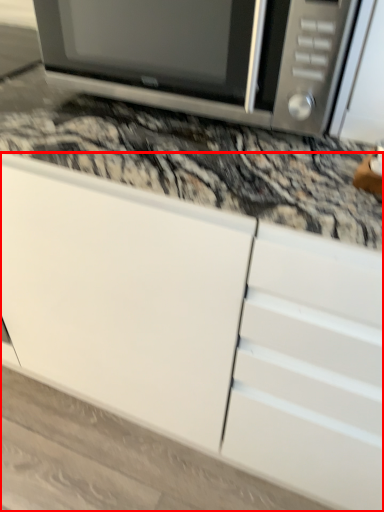
Question: Observing the image, what is the correct spatial positioning of cabinetry (annotated by the red box) in reference to microwave oven?

Choices:
 (A) right
 (B) left

Answer: (B)